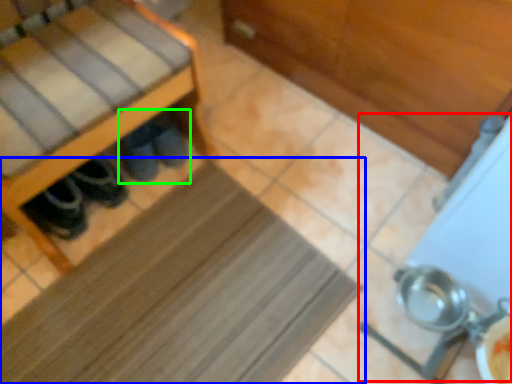
Question: Estimate the real-world distances between objects in this image. Which object is farther from wide (highlighted by a red box), mat (highlighted by a blue box) or footwear (highlighted by a green box)?

Choices:
 (A) mat
 (B) footwear

Answer: (B)